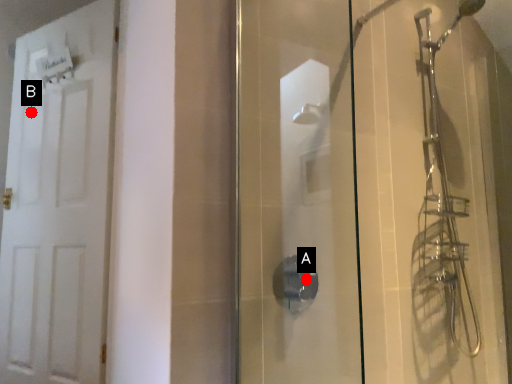
Question: Two points are circled on the image, labeled by A and B beside each circle. Which point appears farthest from the camera in this image?

Choices:
 (A) A is further
 (B) B is further

Answer: (B)